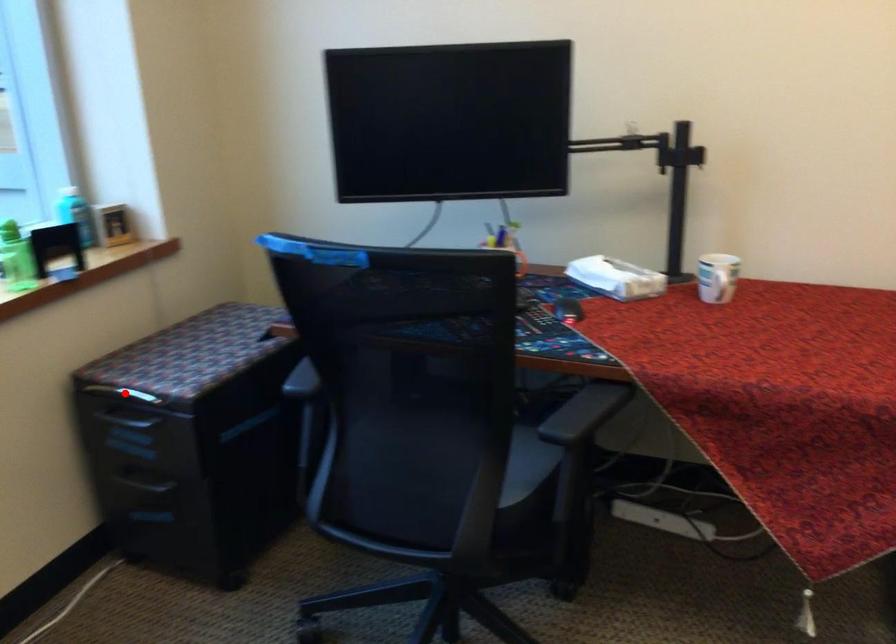
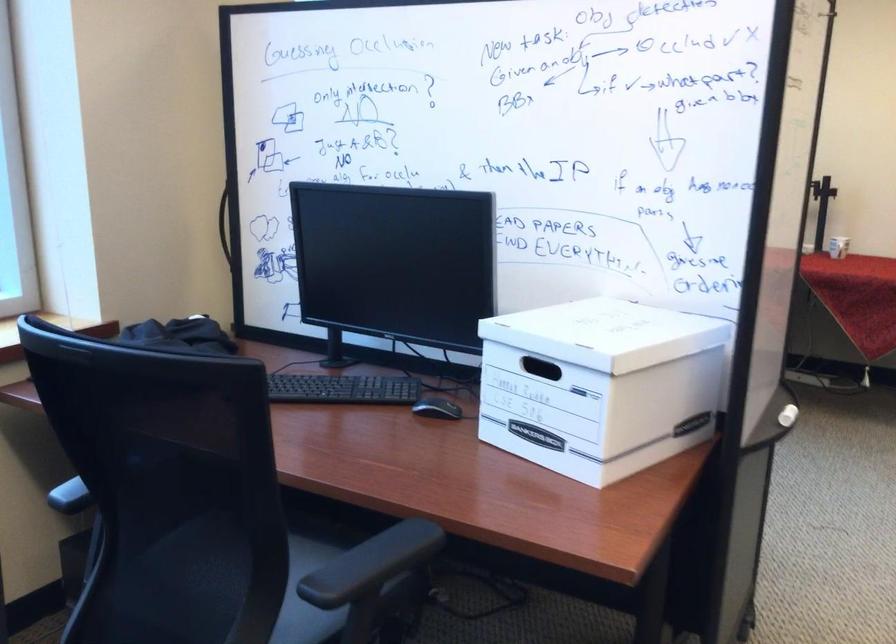
Question: I am providing you with two images of the same scene from different viewpoints. A red point is marked on the first image. At the location where the point appears in image 1, is it still visible in image 2?

Choices:
 (A) Yes
 (B) No

Answer: (B)